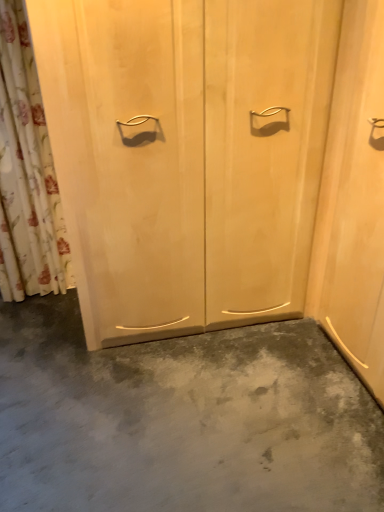
Question: In terms of size, does floral fabric shower curtain at left appear bigger or smaller than light wood/texture door at center?

Choices:
 (A) small
 (B) big

Answer: (A)

Question: Is floral fabric shower curtain at left taller or shorter than light wood/texture door at center?

Choices:
 (A) tall
 (B) short

Answer: (A)

Question: Which is nearer to the light wood/texture door at center?

Choices:
 (A) floral fabric shower curtain at left
 (B) gray matte concrete at center

Answer: (B)

Question: Based on their relative distances, which object is nearer to the gray matte concrete at center?

Choices:
 (A) floral fabric shower curtain at left
 (B) light wood/texture door at center

Answer: (B)